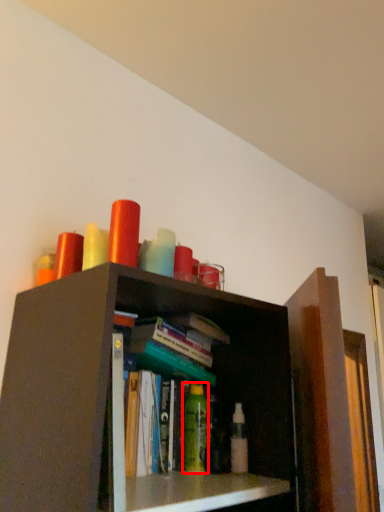
Question: Considering the relative positions of toiletry (annotated by the red box) and toiletry in the image provided, where is toiletry (annotated by the red box) located with respect to the staircase?

Choices:
 (A) left
 (B) right

Answer: (A)